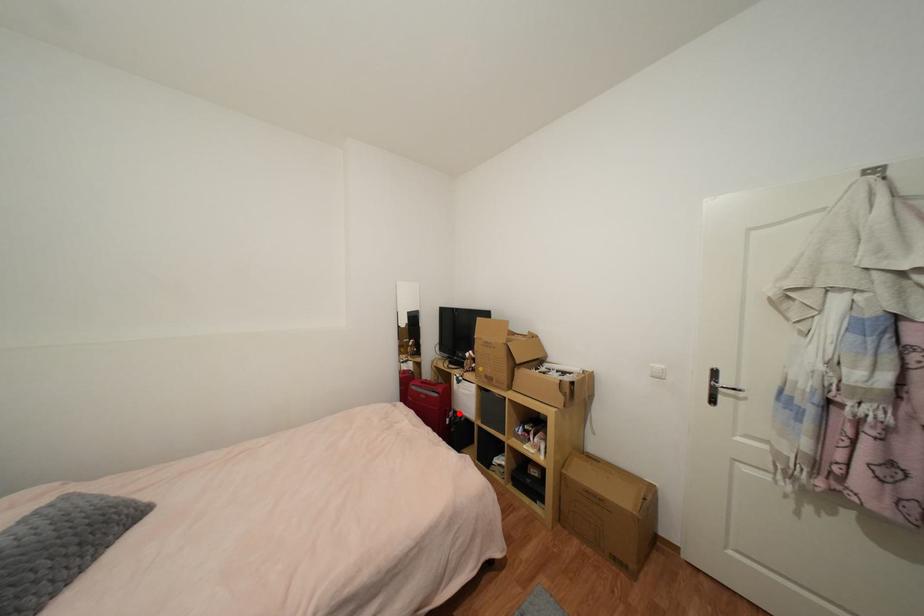
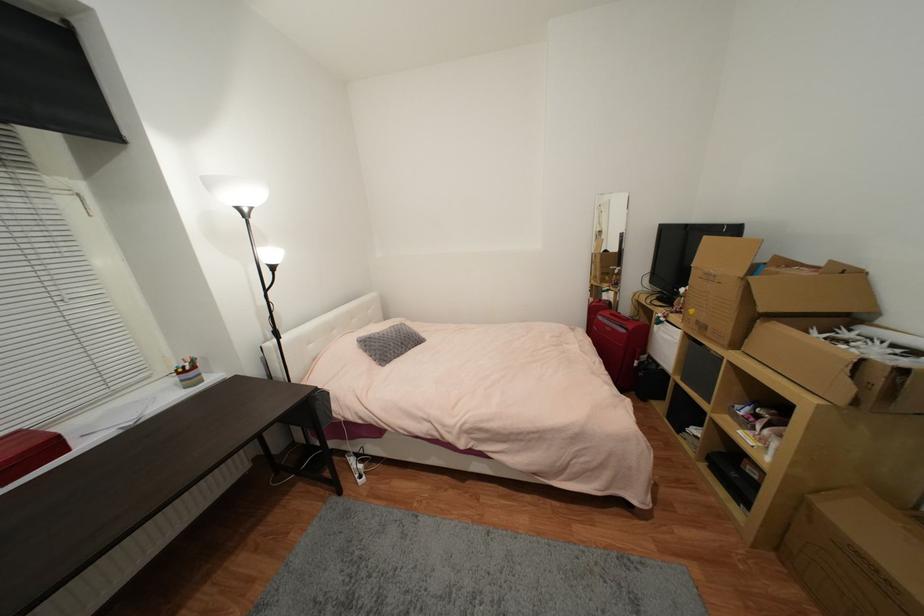
Question: A red point is marked in image1. In image2, is the corresponding 3D point closer to the camera or farther? Reply with the corresponding letter.

Choices:
 (A) The corresponding 3D point is closer.
 (B) The corresponding 3D point is farther.

Answer: (A)